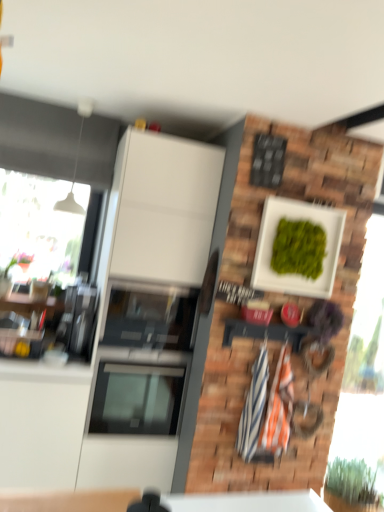
In order to face white glossy cabinet at center, should I rotate leftwards or rightwards?

Rotate your view left by about 6.797°.

Locate an element on the screen. white matte wall at upper center is located at coordinates [200, 56].

Which is in front, white glossy cabinet at center or white matte wall at upper center?

white matte wall at upper center is more forward.

This screenshot has height=512, width=384. I want to click on cabinetry below the white matte wall at upper center (from a real-world perspective), so click(148, 308).

How different are the orientations of white glossy cabinet at center and white matte wall at upper center in degrees?

They differ by 89 degrees in their facing directions.

Considering the sizes of white glossy cabinet at center and white matte wall at upper center in the image, is white glossy cabinet at center taller or shorter than white matte wall at upper center?

In the image, white glossy cabinet at center appears to be taller than white matte wall at upper center.

Can you confirm if green leafy plant at lower right is shorter than white matte wall at upper center?

Incorrect, the height of green leafy plant at lower right does not fall short of that of white matte wall at upper center.

The height and width of the screenshot is (512, 384). I want to click on backdrop above the green leafy plant at lower right (from a real-world perspective), so click(x=200, y=56).

Measure the distance between green leafy plant at lower right and white matte wall at upper center.

The distance of green leafy plant at lower right from white matte wall at upper center is 8.26 feet.

Is green leafy plant at lower right looking in the opposite direction of white matte wall at upper center?

No, white matte wall at upper center is not at the back of green leafy plant at lower right.

From a real-world perspective, relative to green leafy plant at lower right, is white matte wall at upper center vertically above or below?

white matte wall at upper center is situated higher than green leafy plant at lower right in the real world.

Is white matte wall at upper center far from green leafy plant at lower right?

white matte wall at upper center is positioned a significant distance from green leafy plant at lower right.

The width and height of the screenshot is (384, 512). In order to click on plant on the right of white matte wall at upper center in this screenshot , I will do `click(353, 482)`.

Is white matte wall at upper center taller than white glossy cabinet at center?

No, white matte wall at upper center is not taller than white glossy cabinet at center.

From a real-world perspective, is white matte wall at upper center above or below white glossy cabinet at center?

From a real-world perspective, white matte wall at upper center is physically above white glossy cabinet at center.

From the picture: Is white matte wall at upper center turned away from white glossy cabinet at center?

No, white matte wall at upper center's orientation is not away from white glossy cabinet at center.

In the scene shown: What's the angular difference between white matte wall at upper center and white glossy cabinet at center's facing directions?

There is a 89-degree angle between the facing directions of white matte wall at upper center and white glossy cabinet at center.

Based on the photo, is white glossy cabinet at center wider than green leafy plant at lower right?

Correct, the width of white glossy cabinet at center exceeds that of green leafy plant at lower right.

Find the location of a particular element. cabinetry in front of the green leafy plant at lower right is located at coordinates (148, 308).

Does white glossy cabinet at center have a smaller size compared to green leafy plant at lower right?

No, white glossy cabinet at center is not smaller than green leafy plant at lower right.

Can you confirm if green leafy plant at lower right is smaller than white glossy cabinet at center?

Indeed, green leafy plant at lower right has a smaller size compared to white glossy cabinet at center.

From the image's perspective, is green leafy plant at lower right beneath white glossy cabinet at center?

Yes, from the image's perspective, green leafy plant at lower right is beneath white glossy cabinet at center.

Would you consider green leafy plant at lower right to be distant from white glossy cabinet at center?

Yes.

Can you tell me how much green leafy plant at lower right and white glossy cabinet at center differ in facing direction?

green leafy plant at lower right and white glossy cabinet at center are facing 1.94 degrees away from each other.

This screenshot has height=512, width=384. In order to click on backdrop in front of the white glossy cabinet at center in this screenshot , I will do (200, 56).

You are a GUI agent. You are given a task and a screenshot of the screen. Output one action in this format:
    pyautogui.click(x=<x>, y=<y>)
    Task: Click on the plant below the white matte wall at upper center (from the image's perspective)
    
    Given the screenshot: What is the action you would take?
    pyautogui.click(x=353, y=482)

Which object lies nearer to the anchor point white matte wall at upper center, white glossy cabinet at center or green leafy plant at lower right?

white glossy cabinet at center lies closer to white matte wall at upper center than the other object.

Looking at the image, which one is located closer to white matte wall at upper center, green leafy plant at lower right or white glossy cabinet at center?

white glossy cabinet at center.

Looking at the image, which one is located further to green leafy plant at lower right, white glossy cabinet at center or white matte wall at upper center?

Based on the image, white matte wall at upper center appears to be further to green leafy plant at lower right.

When comparing their distances from white glossy cabinet at center, does green leafy plant at lower right or white matte wall at upper center seem closer?

white matte wall at upper center is closer to white glossy cabinet at center.

Estimate the real-world distances between objects in this image. Which object is closer to green leafy plant at lower right, white matte wall at upper center or white glossy cabinet at center?

Based on the image, white glossy cabinet at center appears to be nearer to green leafy plant at lower right.

Based on their spatial positions, is white matte wall at upper center or green leafy plant at lower right further from white glossy cabinet at center?

Based on the image, green leafy plant at lower right appears to be further to white glossy cabinet at center.

I want to click on cabinetry that lies between white matte wall at upper center and green leafy plant at lower right from top to bottom, so click(148, 308).